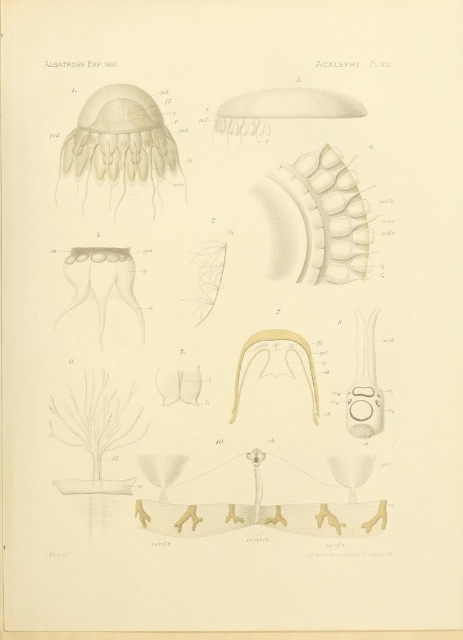
Question: Does smooth beige jellyfish at upper center have a lesser width compared to transparent gelatinous jellyfish at upper center?

Choices:
 (A) yes
 (B) no

Answer: (A)

Question: Estimate the real-world distances between objects in this image. Which object is farther from the translucent yellow jellyfish at center?

Choices:
 (A) smooth beige jellyfish at upper center
 (B) translucent beige jellyfish at upper left
 (C) transparent gelatinous jellyfish at upper center

Answer: (C)

Question: Based on their relative distances, which object is farther from the transparent gelatinous jellyfish at upper center?

Choices:
 (A) smooth beige jellyfish at upper center
 (B) translucent beige jellyfish at upper left

Answer: (B)

Question: Which of these objects is positioned farthest from the smooth beige jellyfish at upper center?

Choices:
 (A) transparent gelatinous jellyfish at upper center
 (B) translucent beige jellyfish at upper left

Answer: (B)

Question: Is the position of smooth beige jellyfish at upper center less distant than that of transparent gelatinous jellyfish at upper center?

Choices:
 (A) no
 (B) yes

Answer: (A)

Question: Does translucent beige jellyfish at upper left have a larger size compared to transparent gelatinous jellyfish at upper center?

Choices:
 (A) no
 (B) yes

Answer: (B)